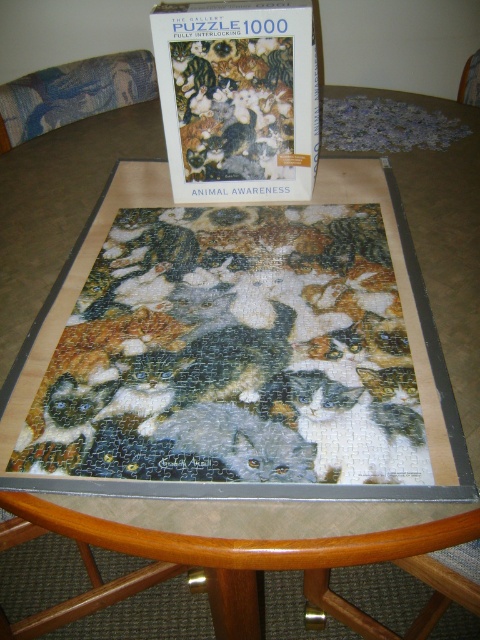
Question: Which of the following is the closest to the observer?

Choices:
 (A) multicolored paper puzzle at center
 (B) matte cardboard puzzle box at upper center

Answer: (A)

Question: Does multicolored paper puzzle at center appear on the right side of matte cardboard puzzle box at upper center?

Choices:
 (A) no
 (B) yes

Answer: (B)

Question: Which object appears farthest from the camera in this image?

Choices:
 (A) multicolored paper puzzle at center
 (B) matte cardboard puzzle box at upper center

Answer: (B)

Question: In this image, where is multicolored paper puzzle at center located relative to matte cardboard puzzle box at upper center?

Choices:
 (A) above
 (B) below

Answer: (B)

Question: Which point is closer to the camera?

Choices:
 (A) matte cardboard puzzle box at upper center
 (B) multicolored paper puzzle at center

Answer: (B)

Question: Does multicolored paper puzzle at center have a smaller size compared to matte cardboard puzzle box at upper center?

Choices:
 (A) no
 (B) yes

Answer: (A)